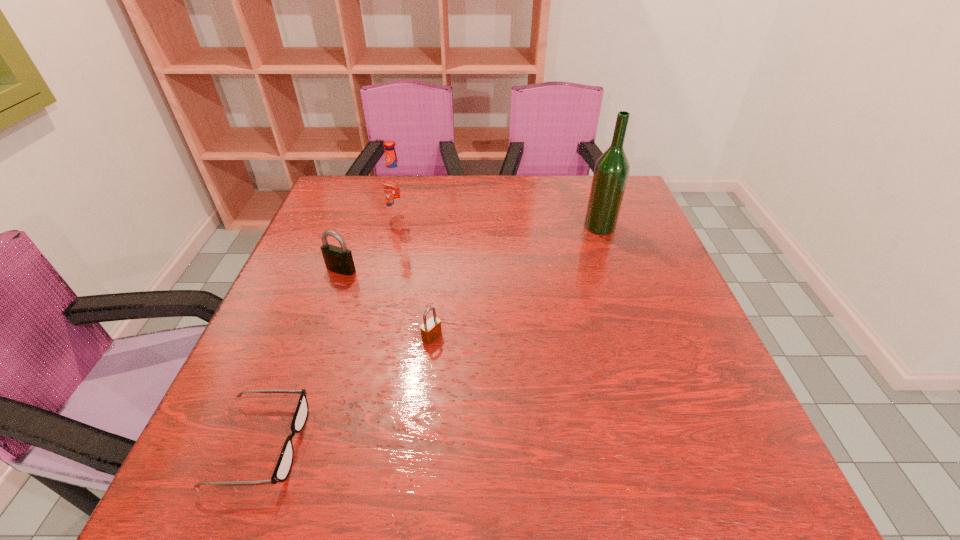
The height and width of the screenshot is (540, 960). I want to click on free space between the shortest object and the right padlock, so click(347, 390).

This screenshot has width=960, height=540. Identify the location of vacant space that is in between the third object from right to left and the rightmost object. (500, 222).

Where is `free area in between the spectacles and the third object from right to left`? free area in between the spectacles and the third object from right to left is located at coordinates (330, 331).

At what (x,y) coordinates should I click in order to perform the action: click on vacant point located between the spectacles and the third tallest object. Please return your answer as a coordinate pair (x, y). This screenshot has height=540, width=960. Looking at the image, I should click on (301, 357).

What are the coordinates of `vacant area that lies between the third object from left to right and the third tallest object` in the screenshot? It's located at (371, 244).

Where is `free space between the third object from right to left and the taller padlock`? Image resolution: width=960 pixels, height=540 pixels. free space between the third object from right to left and the taller padlock is located at coordinates (371, 244).

Locate which object ranks fourth in proximity to the fourth tallest object. Please provide its 2D coordinates. Your answer should be formatted as a tuple, i.e. [(x, y)], where the tuple contains the x and y coordinates of a point satisfying the conditions above.

[(611, 172)]

Select which object is the fourth closest to the spectacles. Please provide its 2D coordinates. Your answer should be formatted as a tuple, i.e. [(x, y)], where the tuple contains the x and y coordinates of a point satisfying the conditions above.

[(611, 172)]

Where is `free point that satisfies the following two spatial constraints: 1. on the front side of the rightmost object; 2. on the left side of the root beer`? The image size is (960, 540). free point that satisfies the following two spatial constraints: 1. on the front side of the rightmost object; 2. on the left side of the root beer is located at coordinates (397, 226).

This screenshot has width=960, height=540. What are the coordinates of `vacant area that satisfies the following two spatial constraints: 1. on the front side of the third object from left to right; 2. on the front-facing side of the shortest object` in the screenshot? It's located at click(x=346, y=444).